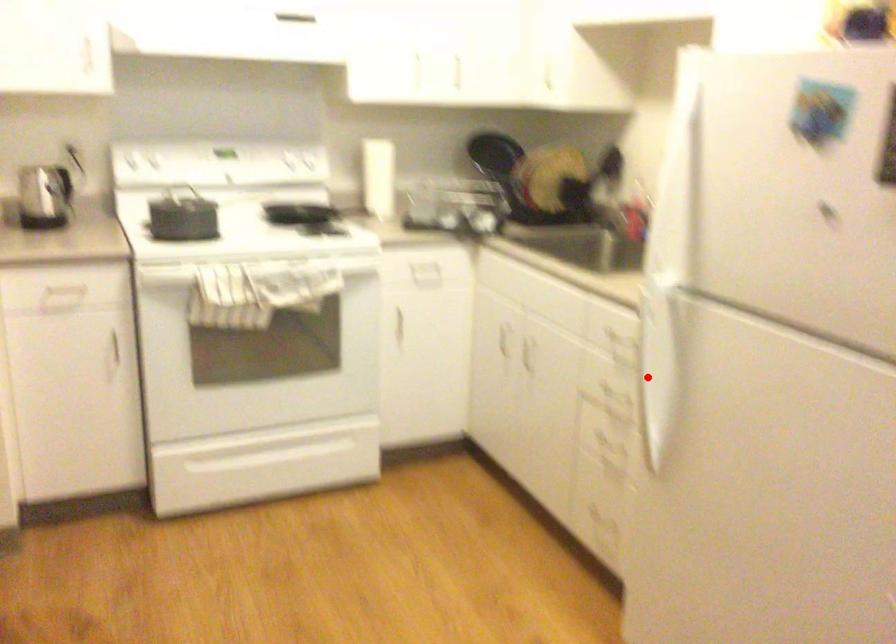
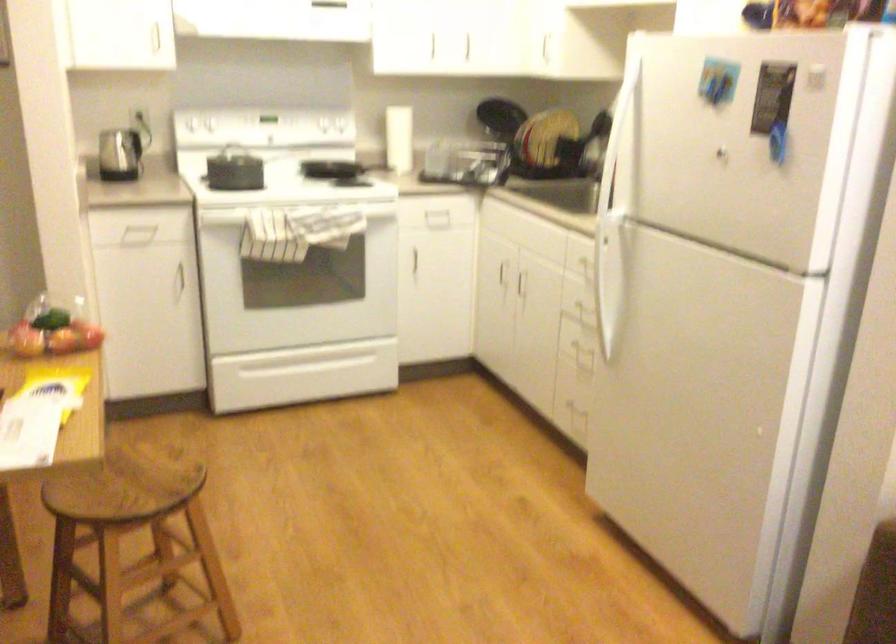
Question: I am providing you with two images of the same scene from different viewpoints. Image1 has a red point marked. In image2, the corresponding 3D location appears at what relative position? Reply with the corresponding letter.

Choices:
 (A) Closer
 (B) Farther

Answer: (B)